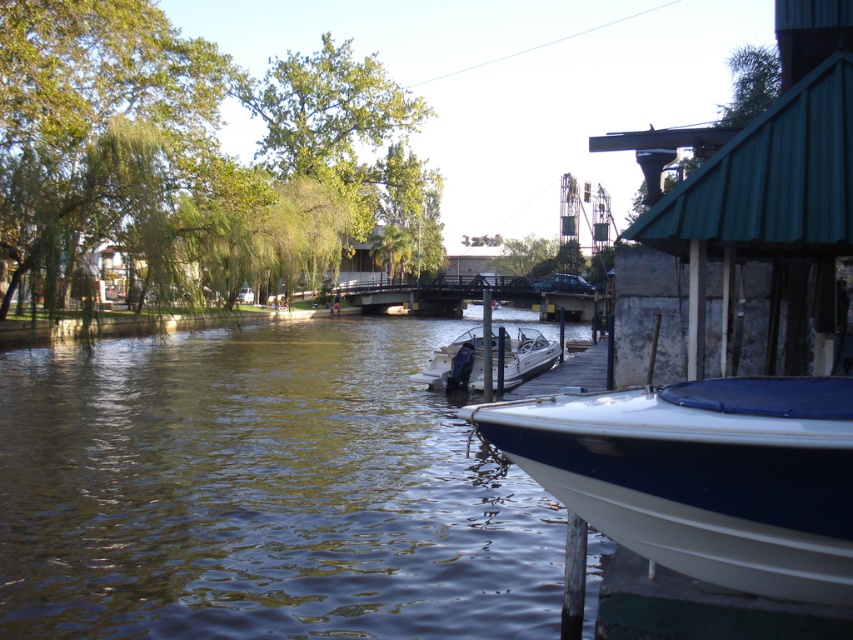
You are standing on the wooden pier and want to walk towards the green leafy tree at center. Which direction should you go relative to the white glossy boat at lower right?

You should walk away from the white glossy boat at lower right because the green leafy tree at center is further away from the viewer than the boat. Moving away from the boat would take you toward the tree.

You are a photographer planning to capture a wide shot of the waterfront scene. You need to ensure both the white glossy boat at lower right and the white glossy motorboat at center are fully visible in the frame. Given their sizes, which boat might require you to adjust your camera angle to include its entire structure?

The white glossy motorboat at center is larger in size compared to the white glossy boat at lower right, so it might require adjusting the camera angle to ensure its entire structure fits within the frame.